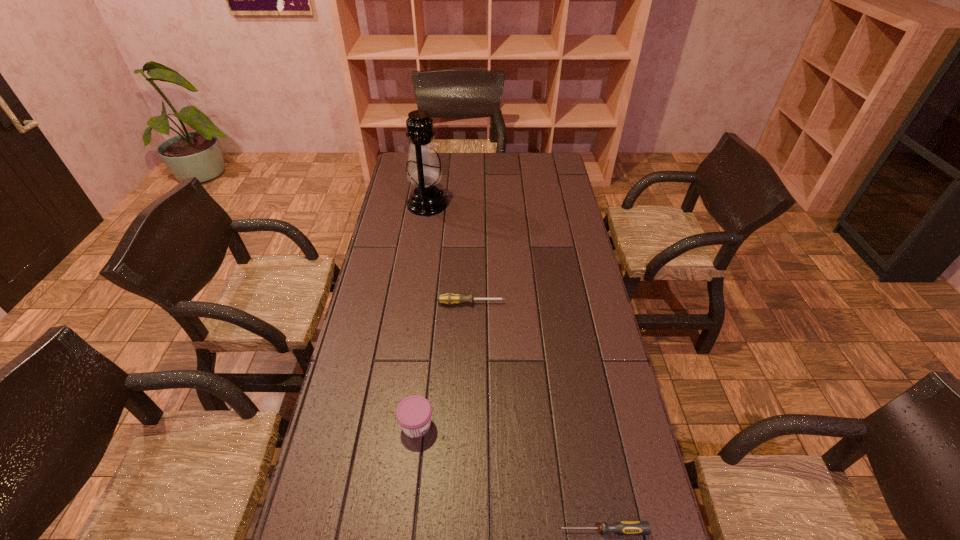
I want to click on free space located 0.210m at the tip of the farther screwdriver, so click(x=567, y=303).

This screenshot has height=540, width=960. Find the location of `vacant area located 0.400m insert the right screwdriver into a screw head`. vacant area located 0.400m insert the right screwdriver into a screw head is located at coordinates (384, 530).

Where is `vacant space located 0.180m insert the right screwdriver into a screw head`? vacant space located 0.180m insert the right screwdriver into a screw head is located at coordinates (481, 530).

This screenshot has width=960, height=540. Find the location of `vacant space located insert the right screwdriver into a screw head`. vacant space located insert the right screwdriver into a screw head is located at coordinates (x=512, y=530).

What are the coordinates of `object situated at the left edge` in the screenshot? It's located at (423, 169).

Locate an element on the screen. This screenshot has width=960, height=540. object that is at the right edge is located at coordinates (624, 527).

Where is `vacant space at the far edge of the desktop`? The height and width of the screenshot is (540, 960). vacant space at the far edge of the desktop is located at coordinates (485, 164).

Image resolution: width=960 pixels, height=540 pixels. In order to click on free space at the left edge in this screenshot , I will do `click(387, 199)`.

The image size is (960, 540). I want to click on vacant space at the right edge of the desktop, so click(566, 276).

The width and height of the screenshot is (960, 540). Find the location of `free space between the tallest object and the jam`. free space between the tallest object and the jam is located at coordinates tap(421, 315).